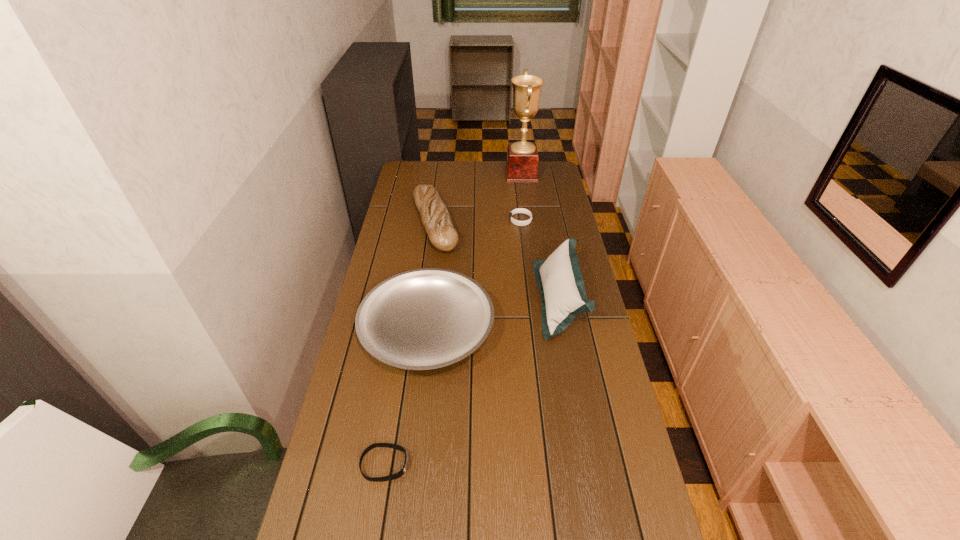
The image size is (960, 540). In order to click on the tallest object in this screenshot , I will do point(522,157).

This screenshot has width=960, height=540. Find the location of `the farthest object`. the farthest object is located at coordinates (522, 157).

This screenshot has height=540, width=960. Identify the location of cushion. (559, 278).

Locate an element on the screen. The height and width of the screenshot is (540, 960). baguet is located at coordinates tap(435, 217).

Where is `the third shortest object`? This screenshot has width=960, height=540. the third shortest object is located at coordinates (422, 319).

Find the location of a particular element. The height and width of the screenshot is (540, 960). the taller wristband is located at coordinates (519, 210).

Identify the location of the right wristband. Image resolution: width=960 pixels, height=540 pixels. (519, 210).

You are a GUI agent. You are given a task and a screenshot of the screen. Output one action in this format:
    pyautogui.click(x=<x>, y=<y>)
    Task: Click on the shortest object
    
    Given the screenshot: What is the action you would take?
    pyautogui.click(x=397, y=475)

Where is `the left wristband`? The image size is (960, 540). the left wristband is located at coordinates 397,475.

You are a GUI agent. You are given a task and a screenshot of the screen. Output one action in this format:
    pyautogui.click(x=<x>, y=<y>)
    Task: Click on the vacant area situated 0.150m on the plaque of the farthest object
    
    Given the screenshot: What is the action you would take?
    pyautogui.click(x=475, y=174)